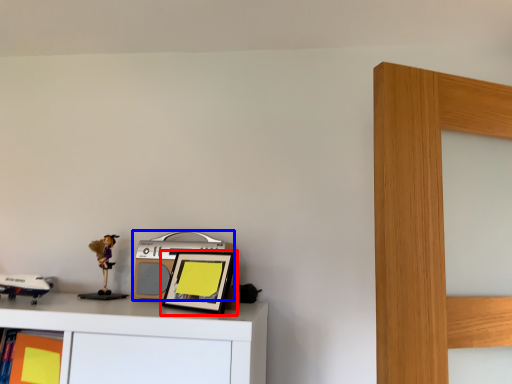
Question: Which of the following is the closest to the observer, picture frame (highlighted by a red box) or stereo (highlighted by a blue box)?

Choices:
 (A) picture frame
 (B) stereo

Answer: (A)